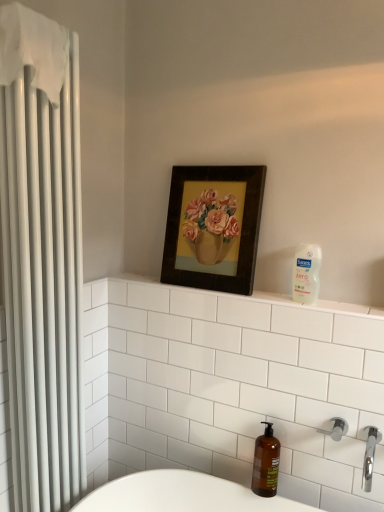
Question: Is the depth of wooden framed painting of flowers at upper center less than that of satin nickel shower at lower right?

Choices:
 (A) no
 (B) yes

Answer: (A)

Question: Are wooden framed painting of flowers at upper center and satin nickel shower at lower right far apart?

Choices:
 (A) no
 (B) yes

Answer: (A)

Question: From a real-world perspective, is wooden framed painting of flowers at upper center physically above satin nickel shower at lower right?

Choices:
 (A) yes
 (B) no

Answer: (A)

Question: Is wooden framed painting of flowers at upper center surrounding satin nickel shower at lower right?

Choices:
 (A) no
 (B) yes

Answer: (A)

Question: From the image's perspective, is wooden framed painting of flowers at upper center beneath satin nickel shower at lower right?

Choices:
 (A) no
 (B) yes

Answer: (A)

Question: From the image's perspective, is chrome metallic faucet at lower right positioned above or below white plastic bottle at upper right?

Choices:
 (A) above
 (B) below

Answer: (B)

Question: Considering their positions, is chrome metallic faucet at lower right located in front of or behind white plastic bottle at upper right?

Choices:
 (A) behind
 (B) front

Answer: (B)

Question: Is chrome metallic faucet at lower right bigger or smaller than white plastic bottle at upper right?

Choices:
 (A) small
 (B) big

Answer: (B)

Question: Which is correct: chrome metallic faucet at lower right is inside white plastic bottle at upper right, or outside of it?

Choices:
 (A) outside
 (B) inside

Answer: (A)

Question: From a real-world perspective, is amber glass soap dispenser at lower right physically located above or below clear plastic soap dispenser at upper right?

Choices:
 (A) below
 (B) above

Answer: (A)

Question: Visually, is amber glass soap dispenser at lower right positioned to the left or to the right of clear plastic soap dispenser at upper right?

Choices:
 (A) left
 (B) right

Answer: (B)

Question: Is amber glass soap dispenser at lower right inside the boundaries of clear plastic soap dispenser at upper right, or outside?

Choices:
 (A) inside
 (B) outside

Answer: (B)

Question: Relative to clear plastic soap dispenser at upper right, is amber glass soap dispenser at lower right in front or behind?

Choices:
 (A) behind
 (B) front

Answer: (A)

Question: Looking at their shapes, would you say satin nickel shower at lower right is wider or thinner than amber glass soap dispenser at lower right?

Choices:
 (A) thin
 (B) wide

Answer: (A)

Question: Would you say satin nickel shower at lower right is inside or outside amber glass soap dispenser at lower right?

Choices:
 (A) outside
 (B) inside

Answer: (A)